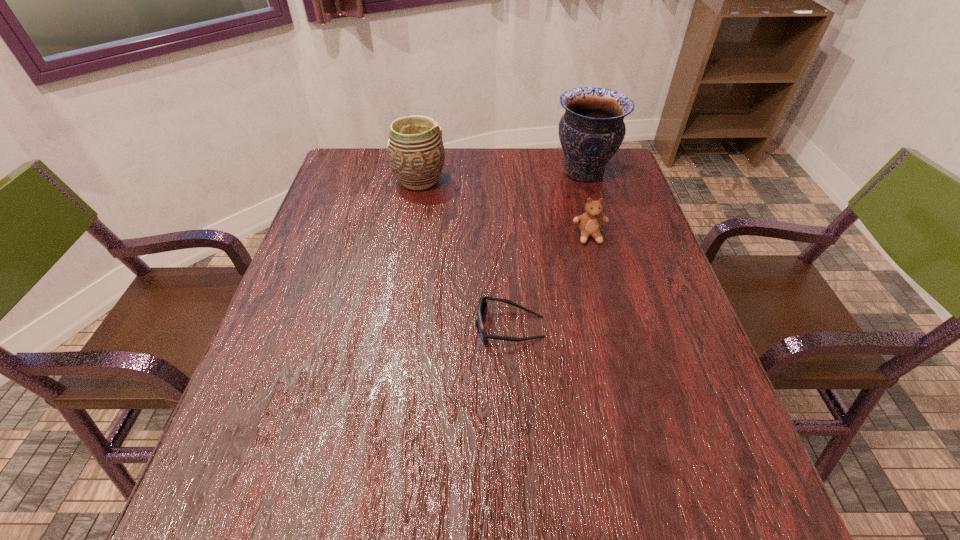
Find the location of a particular element. The height and width of the screenshot is (540, 960). vacant position at the near edge of the desktop is located at coordinates pyautogui.click(x=349, y=484).

Identify the location of vacant space at the left edge of the desktop. Image resolution: width=960 pixels, height=540 pixels. (252, 447).

Where is `free location at the right edge`? free location at the right edge is located at coordinates (623, 214).

In the image, there is a desktop. Where is `vacant space at the near left corner`? vacant space at the near left corner is located at coordinates (216, 494).

The image size is (960, 540). Identify the location of vacant space at the far right corner. (622, 164).

You are a GUI agent. You are given a task and a screenshot of the screen. Output one action in this format:
    pyautogui.click(x=<x>, y=<y>)
    Task: Click on the free space that is in between the third tallest object and the third object from right to left
    Image resolution: width=960 pixels, height=540 pixels.
    Given the screenshot: What is the action you would take?
    pyautogui.click(x=550, y=282)

Locate an element on the screen. This screenshot has height=540, width=960. empty space that is in between the third shortest object and the tallest object is located at coordinates (501, 177).

The image size is (960, 540). I want to click on free space that is in between the third farthest object and the left pottery, so click(504, 208).

Locate an element on the screen. This screenshot has height=540, width=960. unoccupied position between the left pottery and the third object from right to left is located at coordinates (465, 254).

This screenshot has height=540, width=960. In order to click on vacant point located between the right pottery and the leftmost object in this screenshot , I will do click(x=501, y=177).